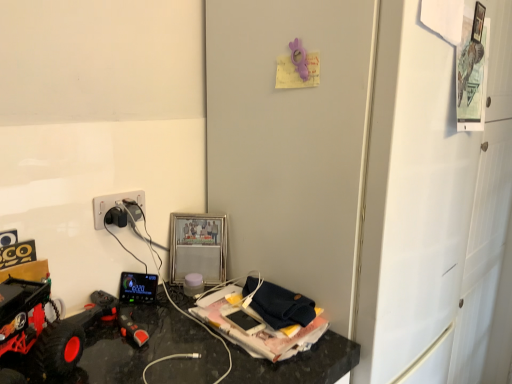
Question: From a real-world perspective, is rubberized black remote control at lower left, the 3th toy viewed from the right, above or below matte white cup at center, positioned as the 1th toy in back-to-front order?

Choices:
 (A) below
 (B) above

Answer: (B)

Question: In the image, is rubberized black remote control at lower left, the 3th toy viewed from the right, positioned in front of or behind matte white cup at center, acting as the 2th toy starting from the top?

Choices:
 (A) behind
 (B) front

Answer: (B)

Question: Which object is positioned farthest from the white matte door at center-right?

Choices:
 (A) matte white cup at center, which is the third toy from front to back
 (B) rubberized black toy car at lower left
 (C) rubberized black remote control at lower left, the 3th toy viewed from the right
 (D) black plastic power plugs and sockets at left
 (E) purple rubber duck at upper center, placed as the second toy when sorted from front to back

Answer: (B)

Question: Estimate the real-world distances between objects in this image. Which object is farther from the rubberized black remote control at lower left, which ranks as the 1th toy in bottom-to-top order?

Choices:
 (A) rubberized black toy car at lower left
 (B) white matte door at center-right
 (C) black plastic power plugs and sockets at left
 (D) purple rubber duck at upper center, acting as the first toy starting from the top
 (E) matte white cup at center, the second toy viewed from the left

Answer: (D)